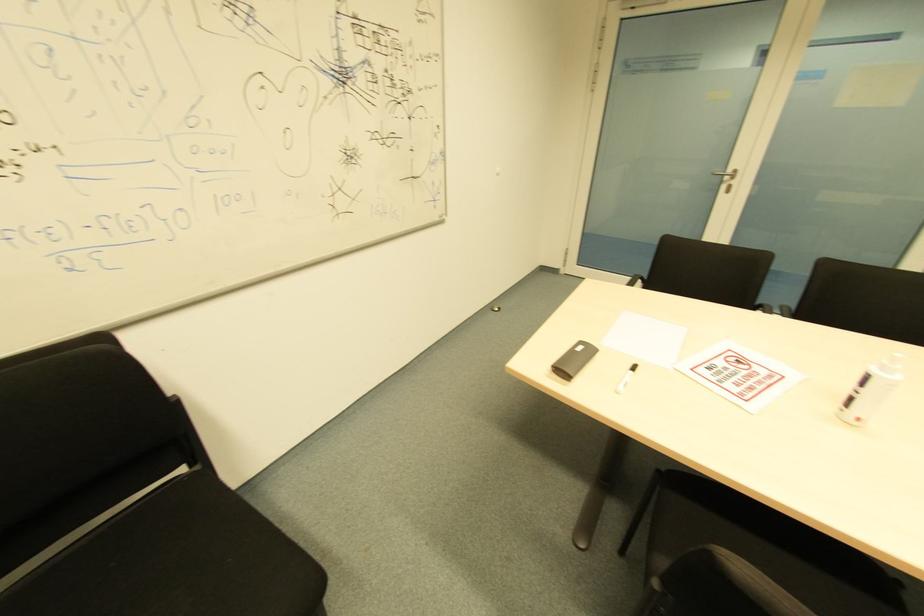
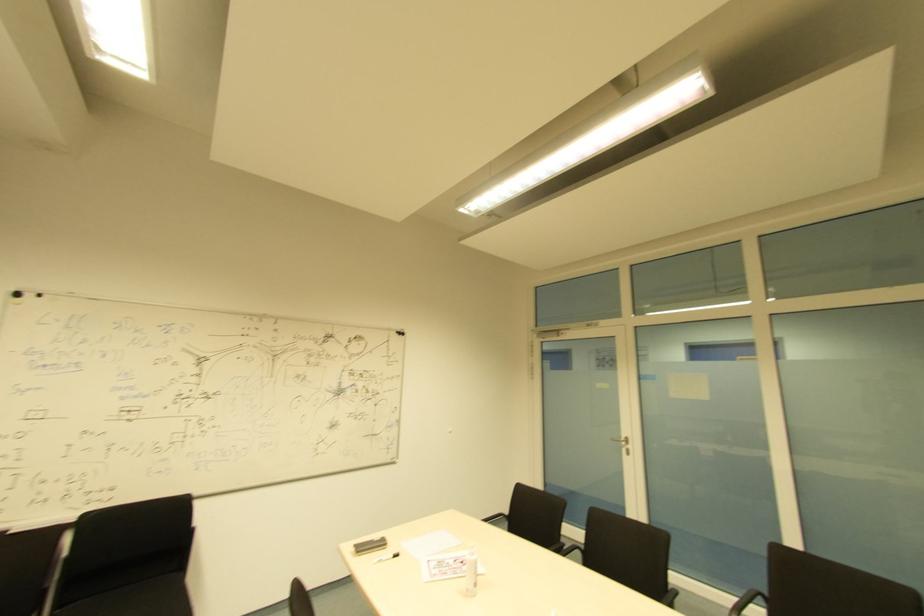
Locate, in the second image, the point that corresponds to the point at 732,184 in the first image.

(628, 450)